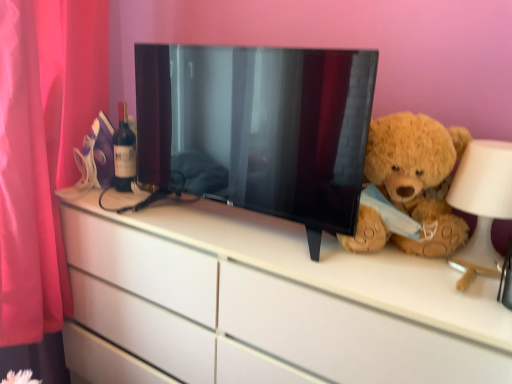
Question: Is white matte table lamp at right surrounding fuzzy brown teddy bear at right?

Choices:
 (A) yes
 (B) no

Answer: (B)

Question: Considering the relative sizes of white matte table lamp at right and fuzzy brown teddy bear at right in the image provided, is white matte table lamp at right wider than fuzzy brown teddy bear at right?

Choices:
 (A) yes
 (B) no

Answer: (B)

Question: Is white matte table lamp at right looking in the opposite direction of fuzzy brown teddy bear at right?

Choices:
 (A) yes
 (B) no

Answer: (B)

Question: Is white matte table lamp at right taller than fuzzy brown teddy bear at right?

Choices:
 (A) no
 (B) yes

Answer: (A)

Question: Is the depth of white matte table lamp at right greater than that of fuzzy brown teddy bear at right?

Choices:
 (A) no
 (B) yes

Answer: (A)

Question: Does white matte table lamp at right turn towards fuzzy brown teddy bear at right?

Choices:
 (A) yes
 (B) no

Answer: (A)

Question: From the image's perspective, would you say white matte table lamp at right is positioned over matte glass bottle at left?

Choices:
 (A) yes
 (B) no

Answer: (B)

Question: Is matte glass bottle at left located within white matte table lamp at right?

Choices:
 (A) yes
 (B) no

Answer: (B)

Question: Does white matte table lamp at right have a lesser height compared to matte glass bottle at left?

Choices:
 (A) yes
 (B) no

Answer: (A)

Question: Considering the relative positions of white matte table lamp at right and matte glass bottle at left in the image provided, is white matte table lamp at right to the right of matte glass bottle at left from the viewer's perspective?

Choices:
 (A) no
 (B) yes

Answer: (B)

Question: Is white matte table lamp at right looking in the opposite direction of matte glass bottle at left?

Choices:
 (A) no
 (B) yes

Answer: (A)

Question: Can you confirm if white matte table lamp at right is wider than matte glass bottle at left?

Choices:
 (A) yes
 (B) no

Answer: (A)

Question: Is black glossy tv at center bigger than matte glass bottle at left?

Choices:
 (A) yes
 (B) no

Answer: (A)